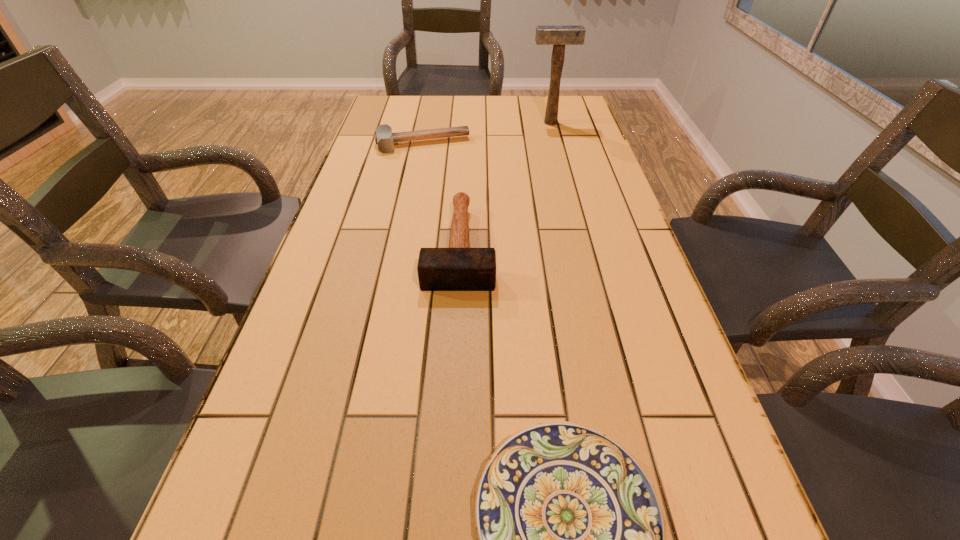
This screenshot has height=540, width=960. What are the coordinates of `the farthest object` in the screenshot? It's located at (558, 36).

Locate an element on the screen. the farthest mallet is located at coordinates (558, 36).

Find the location of a particular element. The width and height of the screenshot is (960, 540). the nearest mallet is located at coordinates (458, 268).

The width and height of the screenshot is (960, 540). I want to click on the second nearest object, so click(x=458, y=268).

Identify the location of the second farthest object. (384, 137).

I want to click on the third tallest object, so click(384, 137).

Find the location of `vacant space located 0.160m on the front of the tallest mallet`. vacant space located 0.160m on the front of the tallest mallet is located at coordinates (557, 147).

This screenshot has width=960, height=540. Identify the location of free space located 0.070m on the hammer head face of the third farthest object. (456, 315).

At what (x,y) coordinates should I click in order to perform the action: click on blank area located 0.120m on the right of the second shortest object. Please return your answer as a coordinate pair (x, y). This screenshot has height=540, width=960. Looking at the image, I should click on (506, 144).

What are the coordinates of `object at the far edge` in the screenshot? It's located at (558, 36).